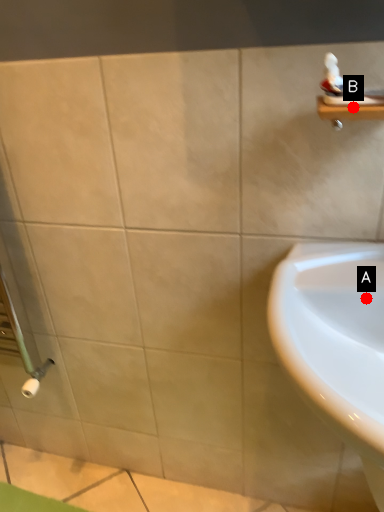
Question: Two points are circled on the image, labeled by A and B beside each circle. Which point is further to the camera?

Choices:
 (A) A is further
 (B) B is further

Answer: (A)